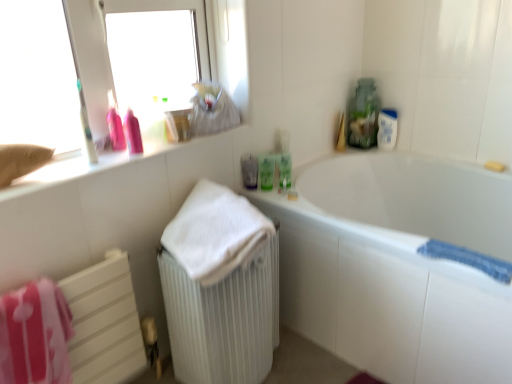
Question: Would you say matte white counter at upper left contains blue textured bath towel at lower right, acting as the first bath towel starting from the right?

Choices:
 (A) no
 (B) yes

Answer: (A)

Question: From a real-world perspective, is matte white counter at upper left located beneath blue textured bath towel at lower right, marked as the 3th bath towel in a left-to-right arrangement?

Choices:
 (A) yes
 (B) no

Answer: (B)

Question: Considering the relative sizes of matte white counter at upper left and blue textured bath towel at lower right, acting as the first bath towel starting from the right, in the image provided, is matte white counter at upper left taller than blue textured bath towel at lower right, acting as the first bath towel starting from the right,?

Choices:
 (A) yes
 (B) no

Answer: (A)

Question: From a real-world perspective, is matte white counter at upper left on top of blue textured bath towel at lower right, marked as the 3th bath towel in a left-to-right arrangement?

Choices:
 (A) no
 (B) yes

Answer: (B)

Question: From the image's perspective, is matte white counter at upper left under blue textured bath towel at lower right, marked as the 3th bath towel in a left-to-right arrangement?

Choices:
 (A) no
 (B) yes

Answer: (A)

Question: Considering their positions, is white ribbed radiator at lower left located in front of or behind pink fabric towel at lower left, the third bath towel viewed from the right?

Choices:
 (A) behind
 (B) front

Answer: (A)

Question: Is point (241, 314) positioned closer to the camera than point (62, 355)?

Choices:
 (A) farther
 (B) closer

Answer: (A)

Question: From a real-world perspective, is white ribbed radiator at lower left physically located above or below pink fabric towel at lower left, which is the 1th bath towel in left-to-right order?

Choices:
 (A) above
 (B) below

Answer: (B)

Question: Considering the relative positions of white ribbed radiator at lower left and pink fabric towel at lower left, which is the 1th bath towel in left-to-right order, in the image provided, is white ribbed radiator at lower left to the left or to the right of pink fabric towel at lower left, which is the 1th bath towel in left-to-right order,?

Choices:
 (A) right
 (B) left

Answer: (A)

Question: Is white ribbed radiator at lower left wider or thinner than white plastic bottle at upper right?

Choices:
 (A) wide
 (B) thin

Answer: (A)

Question: From a real-world perspective, is white ribbed radiator at lower left positioned above or below white plastic bottle at upper right?

Choices:
 (A) below
 (B) above

Answer: (A)

Question: Is point (266, 309) closer or farther from the camera than point (377, 144)?

Choices:
 (A) farther
 (B) closer

Answer: (B)

Question: Would you say white ribbed radiator at lower left is inside or outside white plastic bottle at upper right?

Choices:
 (A) outside
 (B) inside

Answer: (A)

Question: In terms of height, does white ribbed radiator at lower left look taller or shorter compared to green matte bottle at upper right, which is the 3th mouthwash from left to right?

Choices:
 (A) short
 (B) tall

Answer: (B)

Question: Would you say white ribbed radiator at lower left is to the left or to the right of green matte bottle at upper right, which is the first mouthwash in right-to-left order, in the picture?

Choices:
 (A) left
 (B) right

Answer: (A)